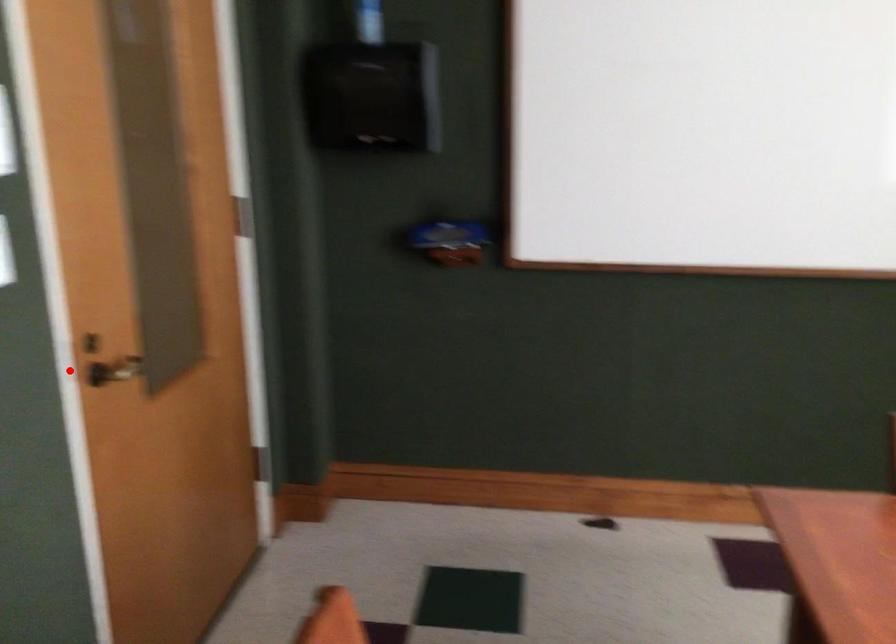
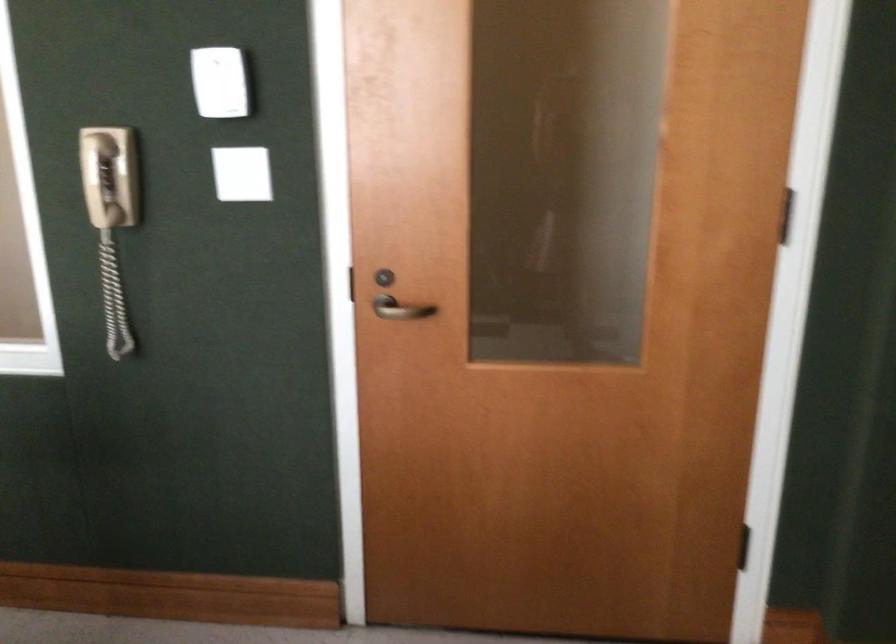
In the second image, find the point that corresponds to the highlighted location in the first image.

(346, 283)